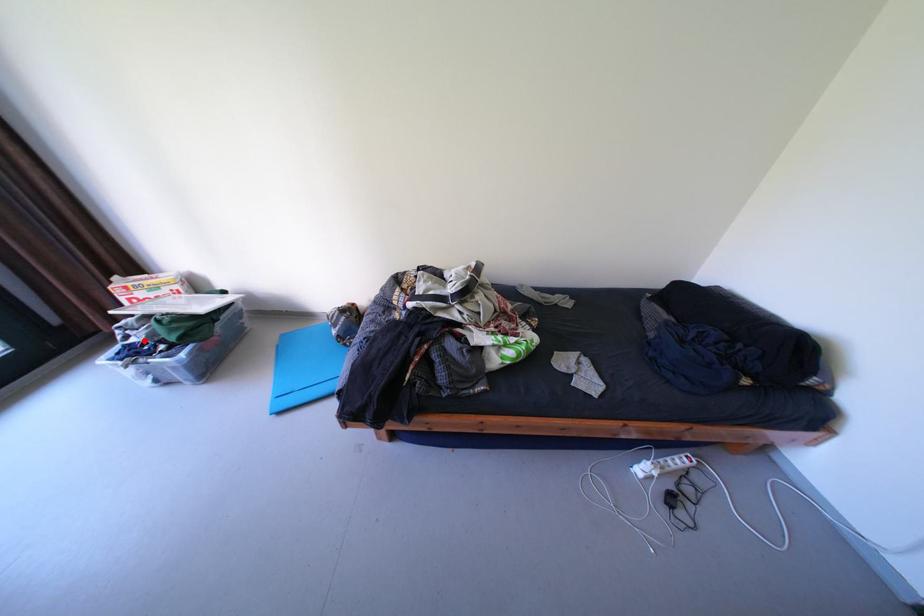
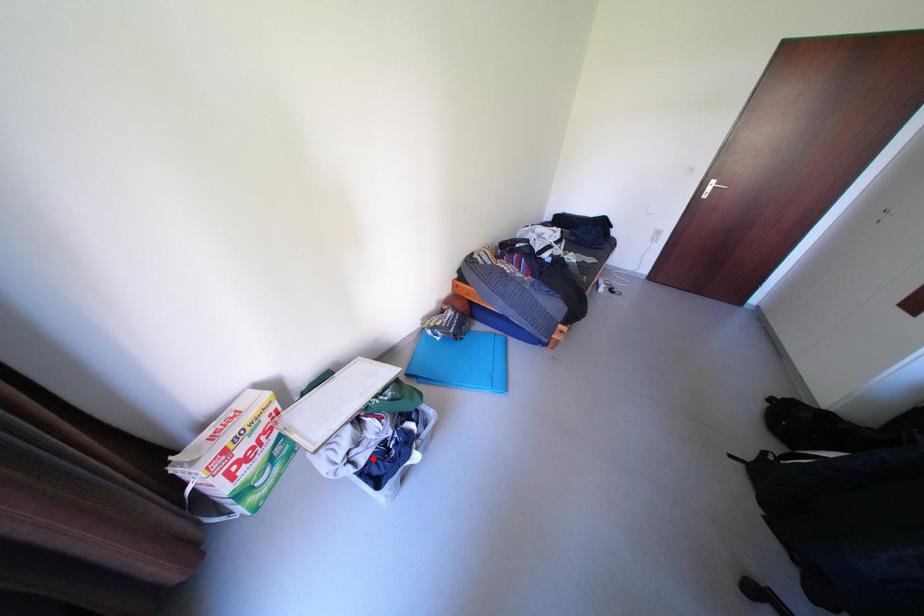
I am providing you with two images of the same scene from different viewpoints. A red point is marked on the first image and another point is marked on the second image. Are the points marked in image1 and image2 representing the same 3D position?

Yes